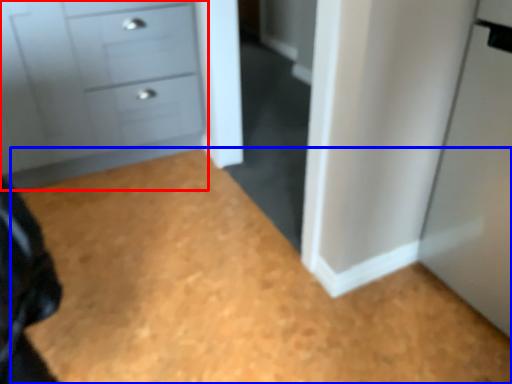
Question: Which of the following is the farthest to the observer, chest of drawers (highlighted by a red box) or plain (highlighted by a blue box)?

Choices:
 (A) chest of drawers
 (B) plain

Answer: (A)